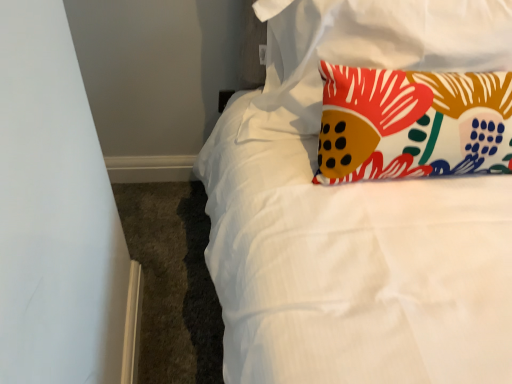
The image size is (512, 384). What do you see at coordinates (366, 50) in the screenshot? I see `floral fabric pillow at upper right, which is counted as the first pillow, starting from the top` at bounding box center [366, 50].

This screenshot has height=384, width=512. In order to click on floral fabric pillow at upper right, which is counted as the first pillow, starting from the top in this screenshot , I will do `click(366, 50)`.

Measure the distance between point (472, 9) and camera.

They are 37.72 inches apart.

Identify the location of floral fabric pillow at upper right, marked as the 1th pillow in a bottom-to-top arrangement. Image resolution: width=512 pixels, height=384 pixels. (412, 124).

What do you see at coordinates (412, 124) in the screenshot?
I see `floral fabric pillow at upper right, marked as the 1th pillow in a bottom-to-top arrangement` at bounding box center [412, 124].

How much space does floral fabric pillow at upper right, the 2th pillow when ordered from top to bottom, occupy horizontally?

8.77 inches.

Where is `floral fabric pillow at upper right, which is counted as the first pillow, starting from the top`? The image size is (512, 384). floral fabric pillow at upper right, which is counted as the first pillow, starting from the top is located at coordinates (366, 50).

Does floral fabric pillow at upper right, marked as the 1th pillow in a bottom-to-top arrangement, appear on the right side of floral fabric pillow at upper right, which is counted as the first pillow, starting from the top?

Yes.

Is the depth of floral fabric pillow at upper right, the 2th pillow when ordered from top to bottom, greater than that of floral fabric pillow at upper right, which is counted as the first pillow, starting from the top?

No.

Which point is more forward, (456,88) or (283,25)?

Positioned in front is point (456,88).

From the image's perspective, which object appears higher, floral fabric pillow at upper right, marked as the 1th pillow in a bottom-to-top arrangement, or floral fabric pillow at upper right, which is counted as the first pillow, starting from the top?

From the image's view, floral fabric pillow at upper right, which is counted as the first pillow, starting from the top, is above.

From a real-world perspective, is floral fabric pillow at upper right, marked as the 1th pillow in a bottom-to-top arrangement, positioned above or below floral fabric pillow at upper right, which is counted as the first pillow, starting from the top?

From a real-world perspective, floral fabric pillow at upper right, marked as the 1th pillow in a bottom-to-top arrangement, is physically below floral fabric pillow at upper right, which is counted as the first pillow, starting from the top.

Is floral fabric pillow at upper right, the 2th pillow when ordered from top to bottom, wider than floral fabric pillow at upper right, which is counted as the first pillow, starting from the top?

Indeed, floral fabric pillow at upper right, the 2th pillow when ordered from top to bottom, has a greater width compared to floral fabric pillow at upper right, which is counted as the first pillow, starting from the top.

Which of these two, floral fabric pillow at upper right, marked as the 1th pillow in a bottom-to-top arrangement, or floral fabric pillow at upper right, which is counted as the first pillow, starting from the top, stands taller?

floral fabric pillow at upper right, marked as the 1th pillow in a bottom-to-top arrangement, is taller.

Is floral fabric pillow at upper right, the 2th pillow when ordered from top to bottom, bigger or smaller than floral fabric pillow at upper right, which is counted as the first pillow, starting from the top?

In the image, floral fabric pillow at upper right, the 2th pillow when ordered from top to bottom, appears to be smaller than floral fabric pillow at upper right, which is counted as the first pillow, starting from the top.

Would you say floral fabric pillow at upper right, marked as the 1th pillow in a bottom-to-top arrangement, contains floral fabric pillow at upper right, which is counted as the first pillow, starting from the top?

No, floral fabric pillow at upper right, which is counted as the first pillow, starting from the top, is not surrounded by floral fabric pillow at upper right, marked as the 1th pillow in a bottom-to-top arrangement.

Would you consider floral fabric pillow at upper right, marked as the 1th pillow in a bottom-to-top arrangement, to be distant from floral fabric pillow at upper right, which is the 2th pillow from bottom to top?

floral fabric pillow at upper right, marked as the 1th pillow in a bottom-to-top arrangement, is near floral fabric pillow at upper right, which is the 2th pillow from bottom to top, not far away.

Is floral fabric pillow at upper right, marked as the 1th pillow in a bottom-to-top arrangement, facing towards floral fabric pillow at upper right, which is counted as the first pillow, starting from the top?

Yes, floral fabric pillow at upper right, marked as the 1th pillow in a bottom-to-top arrangement, faces towards floral fabric pillow at upper right, which is counted as the first pillow, starting from the top.

Looking at this image, could you measure the distance between floral fabric pillow at upper right, marked as the 1th pillow in a bottom-to-top arrangement, and floral fabric pillow at upper right, which is the 2th pillow from bottom to top?

14.38 centimeters.

Find the location of `pillow on the left of floral fabric pillow at upper right, marked as the 1th pillow in a bottom-to-top arrangement`. pillow on the left of floral fabric pillow at upper right, marked as the 1th pillow in a bottom-to-top arrangement is located at coordinates (366, 50).

Is floral fabric pillow at upper right, which is counted as the first pillow, starting from the top, at the left side of floral fabric pillow at upper right, marked as the 1th pillow in a bottom-to-top arrangement?

Yes, floral fabric pillow at upper right, which is counted as the first pillow, starting from the top, is to the left of floral fabric pillow at upper right, marked as the 1th pillow in a bottom-to-top arrangement.

Based on the photo, is floral fabric pillow at upper right, which is the 2th pillow from bottom to top, positioned before floral fabric pillow at upper right, marked as the 1th pillow in a bottom-to-top arrangement?

No, floral fabric pillow at upper right, which is the 2th pillow from bottom to top, is further to the viewer.

Which is behind, point (436, 40) or point (324, 164)?

The point (436, 40) is farther.

From the image's perspective, which object appears higher, floral fabric pillow at upper right, which is the 2th pillow from bottom to top, or floral fabric pillow at upper right, the 2th pillow when ordered from top to bottom?

floral fabric pillow at upper right, which is the 2th pillow from bottom to top, appears higher in the image.

From a real-world perspective, is floral fabric pillow at upper right, which is counted as the first pillow, starting from the top, positioned above or below floral fabric pillow at upper right, marked as the 1th pillow in a bottom-to-top arrangement?

From a real-world perspective, floral fabric pillow at upper right, which is counted as the first pillow, starting from the top, is physically above floral fabric pillow at upper right, marked as the 1th pillow in a bottom-to-top arrangement.

Considering the sizes of objects floral fabric pillow at upper right, which is counted as the first pillow, starting from the top, and floral fabric pillow at upper right, the 2th pillow when ordered from top to bottom, in the image provided, who is thinner, floral fabric pillow at upper right, which is counted as the first pillow, starting from the top, or floral fabric pillow at upper right, the 2th pillow when ordered from top to bottom,?

With smaller width is floral fabric pillow at upper right, which is counted as the first pillow, starting from the top.

Considering the sizes of objects floral fabric pillow at upper right, which is the 2th pillow from bottom to top, and floral fabric pillow at upper right, the 2th pillow when ordered from top to bottom, in the image provided, who is shorter, floral fabric pillow at upper right, which is the 2th pillow from bottom to top, or floral fabric pillow at upper right, the 2th pillow when ordered from top to bottom,?

Standing shorter between the two is floral fabric pillow at upper right, which is the 2th pillow from bottom to top.

Is floral fabric pillow at upper right, which is the 2th pillow from bottom to top, bigger than floral fabric pillow at upper right, the 2th pillow when ordered from top to bottom?

Correct, floral fabric pillow at upper right, which is the 2th pillow from bottom to top, is larger in size than floral fabric pillow at upper right, the 2th pillow when ordered from top to bottom.

Is floral fabric pillow at upper right, which is counted as the first pillow, starting from the top, positioned beyond the bounds of floral fabric pillow at upper right, the 2th pillow when ordered from top to bottom?

Indeed, floral fabric pillow at upper right, which is counted as the first pillow, starting from the top, is completely outside floral fabric pillow at upper right, the 2th pillow when ordered from top to bottom.

Are floral fabric pillow at upper right, which is the 2th pillow from bottom to top, and floral fabric pillow at upper right, the 2th pillow when ordered from top to bottom, making contact?

floral fabric pillow at upper right, which is the 2th pillow from bottom to top, and floral fabric pillow at upper right, the 2th pillow when ordered from top to bottom, are not in contact.

Is floral fabric pillow at upper right, which is the 2th pillow from bottom to top, looking in the opposite direction of floral fabric pillow at upper right, the 2th pillow when ordered from top to bottom?

That's right, floral fabric pillow at upper right, which is the 2th pillow from bottom to top, is facing away from floral fabric pillow at upper right, the 2th pillow when ordered from top to bottom.

Can you tell me how much floral fabric pillow at upper right, which is the 2th pillow from bottom to top, and floral fabric pillow at upper right, marked as the 1th pillow in a bottom-to-top arrangement, differ in facing direction?

1.7 degrees.

From the picture: Measure the distance between floral fabric pillow at upper right, which is counted as the first pillow, starting from the top, and floral fabric pillow at upper right, marked as the 1th pillow in a bottom-to-top arrangement.

They are 5.66 inches apart.

In the image, there is a floral fabric pillow at upper right, which is the 2th pillow from bottom to top. What are the coordinates of `pillow below it (from the image's perspective)` in the screenshot? It's located at (412, 124).

This screenshot has height=384, width=512. What are the coordinates of `pillow that is on the left side of floral fabric pillow at upper right, marked as the 1th pillow in a bottom-to-top arrangement` in the screenshot? It's located at (366, 50).

Image resolution: width=512 pixels, height=384 pixels. Identify the location of pillow located underneath the floral fabric pillow at upper right, which is counted as the first pillow, starting from the top (from a real-world perspective). (412, 124).